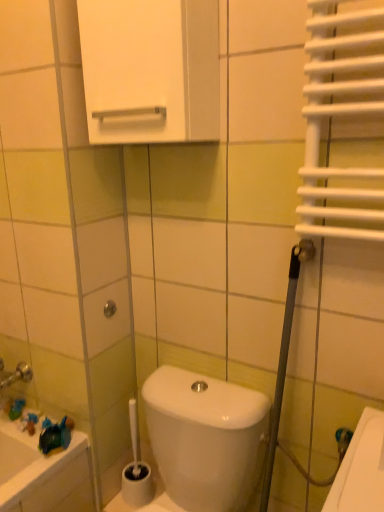
Question: Based on their positions, is white glossy cabinet at upper center located to the left or right of metallic silver shower at center?

Choices:
 (A) right
 (B) left

Answer: (A)

Question: Is white glossy cabinet at upper center taller or shorter than metallic silver shower at center?

Choices:
 (A) short
 (B) tall

Answer: (B)

Question: Which object is the farthest from the white glossy cabinet at upper center?

Choices:
 (A) white plastic toilet brush at lower center
 (B) metallic silver shower at center

Answer: (A)

Question: Based on their relative distances, which object is farther from the metallic silver shower at center?

Choices:
 (A) white glossy cabinet at upper center
 (B) white plastic toilet brush at lower center

Answer: (A)